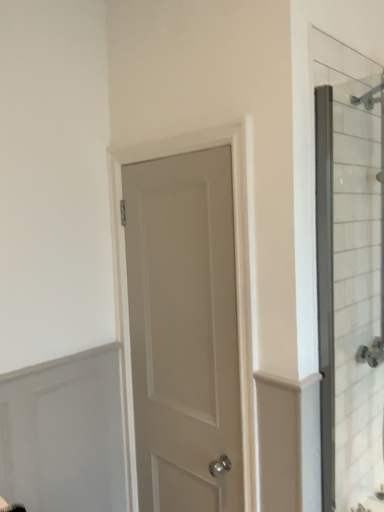
Question: Considering the positions of clear glass shower door at right and white matte door at center in the image, is clear glass shower door at right wider or thinner than white matte door at center?

Choices:
 (A) thin
 (B) wide

Answer: (A)

Question: From the image's perspective, is clear glass shower door at right positioned above or below white matte door at center?

Choices:
 (A) above
 (B) below

Answer: (A)

Question: Is clear glass shower door at right to the left or to the right of white matte door at center in the image?

Choices:
 (A) left
 (B) right

Answer: (B)

Question: Is white matte door at center in front of or behind clear glass shower door at right in the image?

Choices:
 (A) behind
 (B) front

Answer: (A)

Question: Considering the positions of white matte door at center and clear glass shower door at right in the image, is white matte door at center bigger or smaller than clear glass shower door at right?

Choices:
 (A) small
 (B) big

Answer: (B)

Question: Considering the positions of white matte door at center and clear glass shower door at right in the image, is white matte door at center wider or thinner than clear glass shower door at right?

Choices:
 (A) thin
 (B) wide

Answer: (B)

Question: From their relative heights in the image, would you say white matte door at center is taller or shorter than clear glass shower door at right?

Choices:
 (A) short
 (B) tall

Answer: (B)